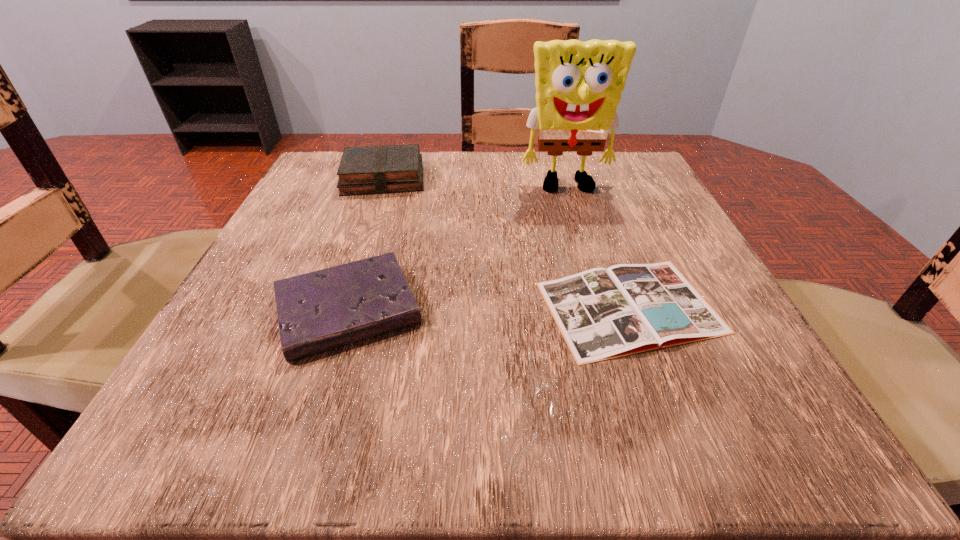
Locate an element on the screen. Image resolution: width=960 pixels, height=540 pixels. sponge is located at coordinates (578, 84).

Identify the location of the second tallest object. This screenshot has height=540, width=960. (382, 169).

I want to click on the taller book, so click(382, 169).

Identify the location of the second shortest object. (318, 311).

Where is `the shorter book`? This screenshot has height=540, width=960. the shorter book is located at coordinates [602, 314].

Where is `the shortest object`? The height and width of the screenshot is (540, 960). the shortest object is located at coordinates (602, 314).

Where is `vacant space located 0.060m on the face of the tallest object`? vacant space located 0.060m on the face of the tallest object is located at coordinates (577, 217).

The height and width of the screenshot is (540, 960). I want to click on vacant space situated 0.250m on the front of the left book, so click(x=348, y=280).

Image resolution: width=960 pixels, height=540 pixels. Identify the location of free space located 0.080m on the front of the diary. (312, 422).

At what (x,y) coordinates should I click in order to perform the action: click on vacant space located 0.380m on the back of the right book. Please return your answer as a coordinate pair (x, y). The width and height of the screenshot is (960, 540). Looking at the image, I should click on (575, 157).